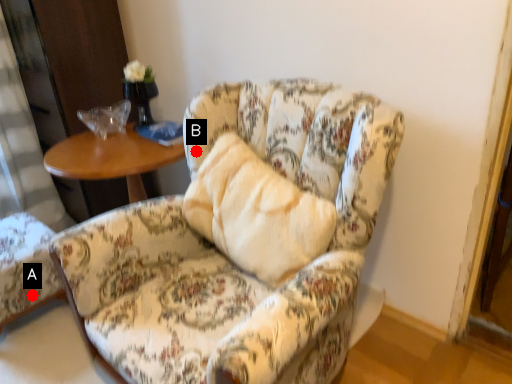
Question: Two points are circled on the image, labeled by A and B beside each circle. Which point is farther from the camera taking this photo?

Choices:
 (A) A is further
 (B) B is further

Answer: (A)